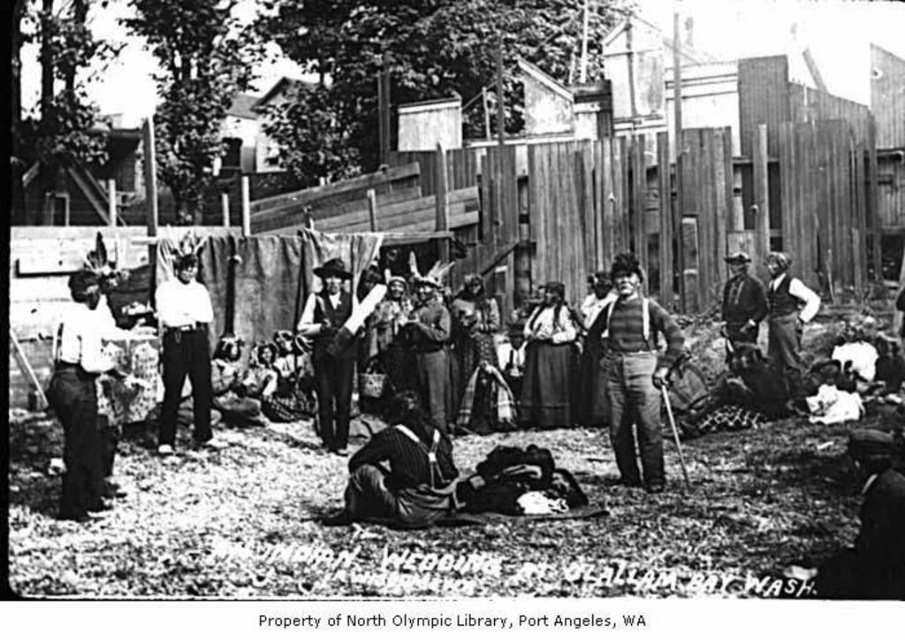
Can you confirm if matte brown dress at center is smaller than rustic wood cane at center?

Incorrect, matte brown dress at center is not smaller in size than rustic wood cane at center.

Does matte brown dress at center have a lesser width compared to rustic wood cane at center?

No.

Image resolution: width=905 pixels, height=640 pixels. What are the coordinates of `matte brown dress at center` in the screenshot? It's located at (548, 362).

Who is more distant from viewer, (884,589) or (418,308)?

Positioned behind is point (418,308).

Looking at this image, is dark brown leather hat at lower right shorter than leather jacket at center?

Indeed, dark brown leather hat at lower right has a lesser height compared to leather jacket at center.

Describe the element at coordinates (868, 525) in the screenshot. I see `dark brown leather hat at lower right` at that location.

This screenshot has width=905, height=640. Identify the location of dark brown leather hat at lower right. (868, 525).

Measure the distance between striped fabric pants at center and dark brown leather hat at lower right.

The distance of striped fabric pants at center from dark brown leather hat at lower right is 16.83 feet.

Can you confirm if striped fabric pants at center is positioned to the right of dark brown leather hat at lower right?

No, striped fabric pants at center is not to the right of dark brown leather hat at lower right.

Who is more distant from viewer, (416, 456) or (873, 596)?

The point (416, 456) is more distant.

At what (x,y) coordinates should I click in order to perform the action: click on striped fabric pants at center. Please return your answer as a coordinate pair (x, y). The height and width of the screenshot is (640, 905). Looking at the image, I should click on (402, 470).